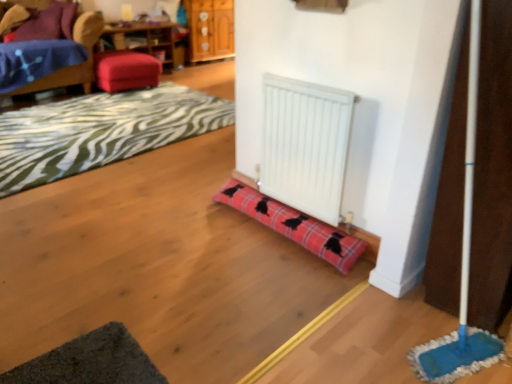
Where is `free space in front of red plaid doorstop at center`? free space in front of red plaid doorstop at center is located at coordinates (259, 288).